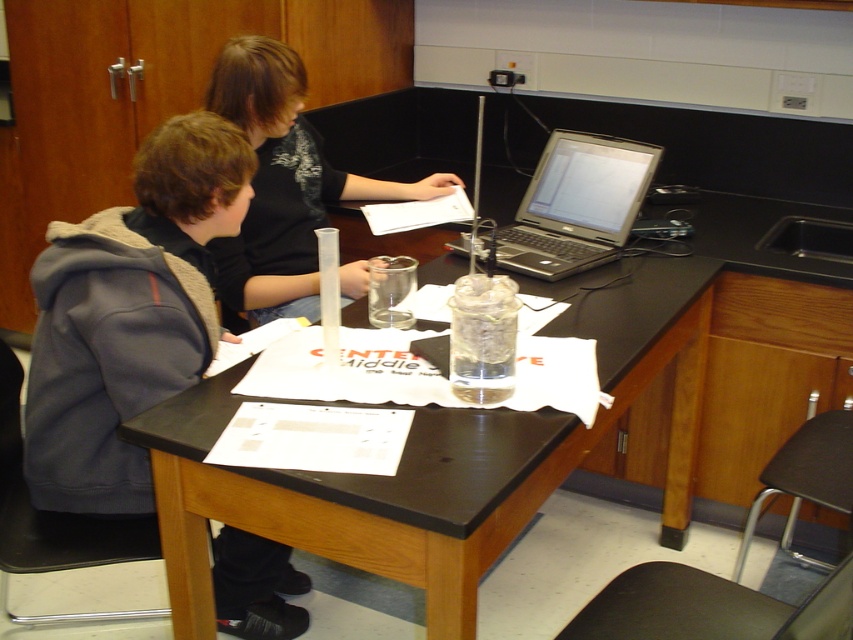
Question: Which point is closer to the camera?

Choices:
 (A) [697, 326]
 (B) [165, 323]
 (C) [619, 246]
 (D) [273, 234]

Answer: (B)

Question: Is black matte shirt at center bigger than black plastic stool at lower right?

Choices:
 (A) yes
 (B) no

Answer: (A)

Question: Can you confirm if gray fleece hoodie at left is bigger than black matte shirt at center?

Choices:
 (A) no
 (B) yes

Answer: (A)

Question: Which object appears closest to the camera in this image?

Choices:
 (A) black plastic stool at lower right
 (B) black matte table at center
 (C) gray fleece hoodie at left

Answer: (B)

Question: Is black matte table at center thinner than gray fleece hoodie at left?

Choices:
 (A) yes
 (B) no

Answer: (B)

Question: Which object appears closest to the camera in this image?

Choices:
 (A) black plastic stool at lower right
 (B) black matte shirt at center

Answer: (A)